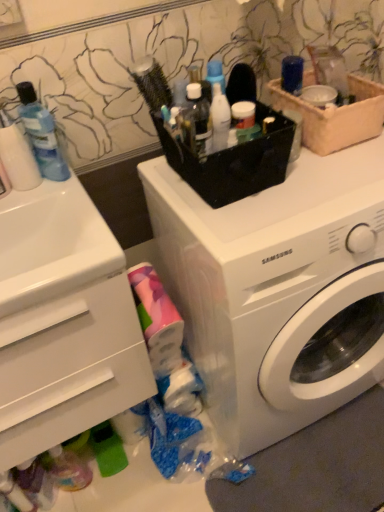
Where is `vacant region in front of blue matte bottle at upper left`? The width and height of the screenshot is (384, 512). vacant region in front of blue matte bottle at upper left is located at coordinates (60, 201).